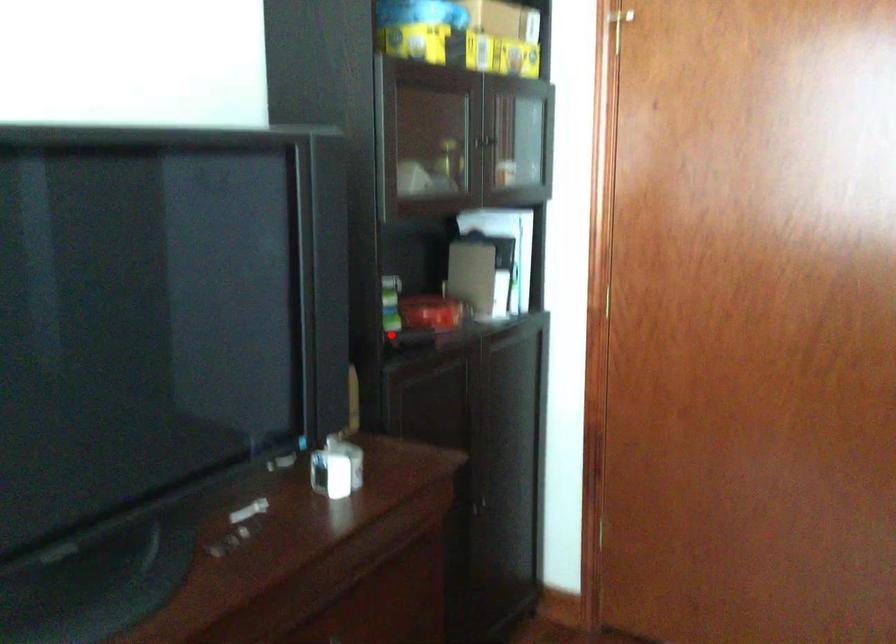
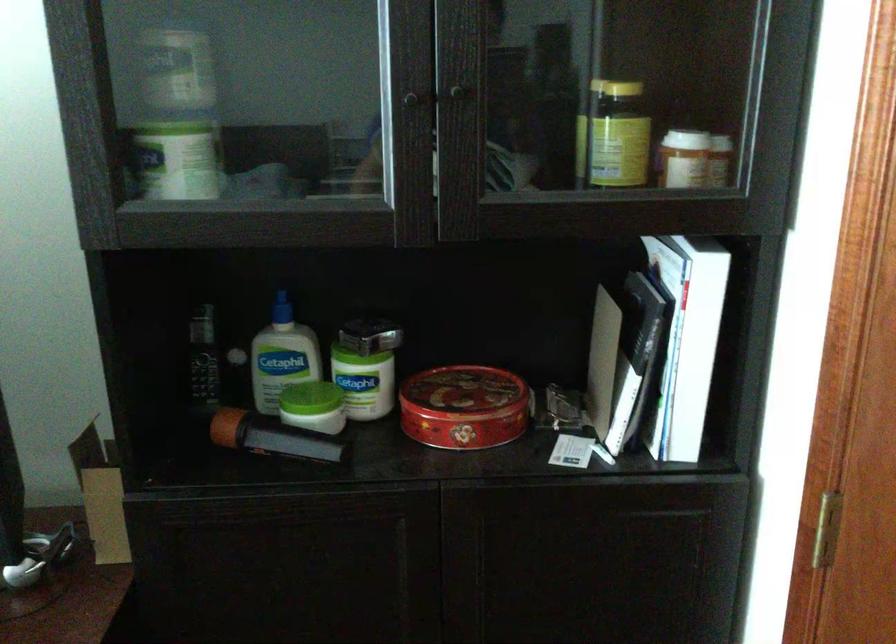
The point at the highlighted location is marked in the first image. Where is the corresponding point in the second image?

(268, 436)